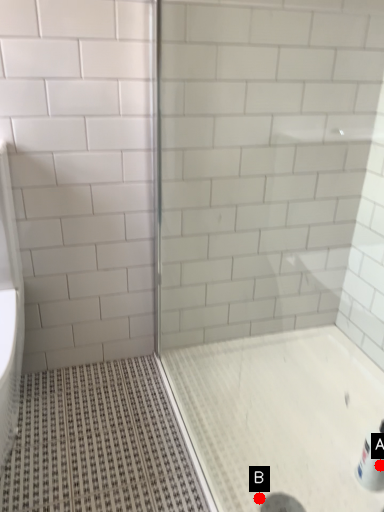
Question: Two points are circled on the image, labeled by A and B beside each circle. Which point appears farthest from the camera in this image?

Choices:
 (A) A is further
 (B) B is further

Answer: (A)